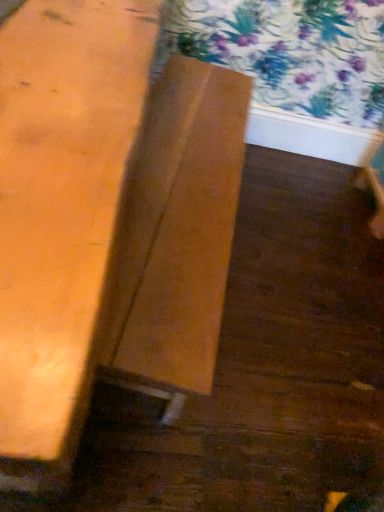
The image size is (384, 512). What do you see at coordinates (107, 222) in the screenshot?
I see `wooden table at center` at bounding box center [107, 222].

In order to click on wooden table at center in this screenshot , I will do pyautogui.click(x=107, y=222).

The width and height of the screenshot is (384, 512). What are the coordinates of `wooden table at center` in the screenshot? It's located at (107, 222).